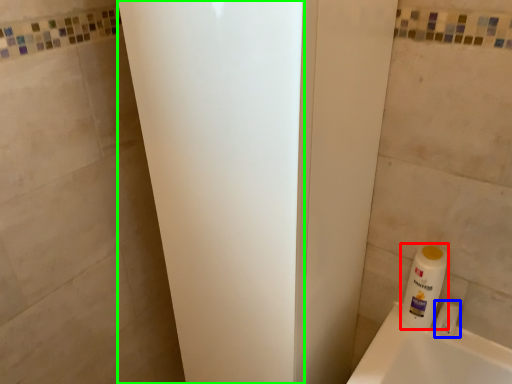
Question: Based on their relative distances, which object is farther from cleaning product (highlighted by a red box)? Choose from toiletry (highlighted by a blue box) and screen door (highlighted by a green box).

Choices:
 (A) toiletry
 (B) screen door

Answer: (B)